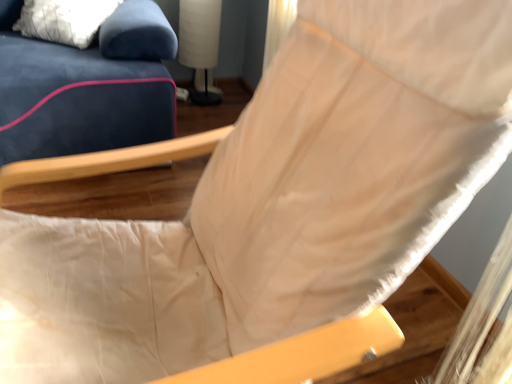
Question: Choose the correct answer: Is white fabric lampshade at upper center inside white textured pillow at upper left or outside it?

Choices:
 (A) inside
 (B) outside

Answer: (B)

Question: From a real-world perspective, is white fabric lampshade at upper center positioned above or below white textured pillow at upper left?

Choices:
 (A) above
 (B) below

Answer: (B)

Question: Is white fabric lampshade at upper center to the left or to the right of white textured pillow at upper left in the image?

Choices:
 (A) right
 (B) left

Answer: (A)

Question: Is point (57, 16) closer or farther from the camera than point (202, 34)?

Choices:
 (A) farther
 (B) closer

Answer: (B)

Question: Considering the positions of white textured pillow at upper left and white fabric lampshade at upper center in the image, is white textured pillow at upper left wider or thinner than white fabric lampshade at upper center?

Choices:
 (A) wide
 (B) thin

Answer: (A)

Question: Relative to white fabric lampshade at upper center, is white textured pillow at upper left in front or behind?

Choices:
 (A) behind
 (B) front

Answer: (B)

Question: From their relative heights in the image, would you say white textured pillow at upper left is taller or shorter than white fabric lampshade at upper center?

Choices:
 (A) tall
 (B) short

Answer: (B)